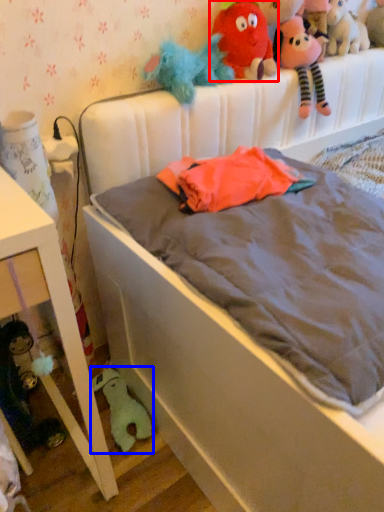
Question: Which point is further to the camera, toy (highlighted by a red box) or toy (highlighted by a blue box)?

Choices:
 (A) toy
 (B) toy

Answer: (B)